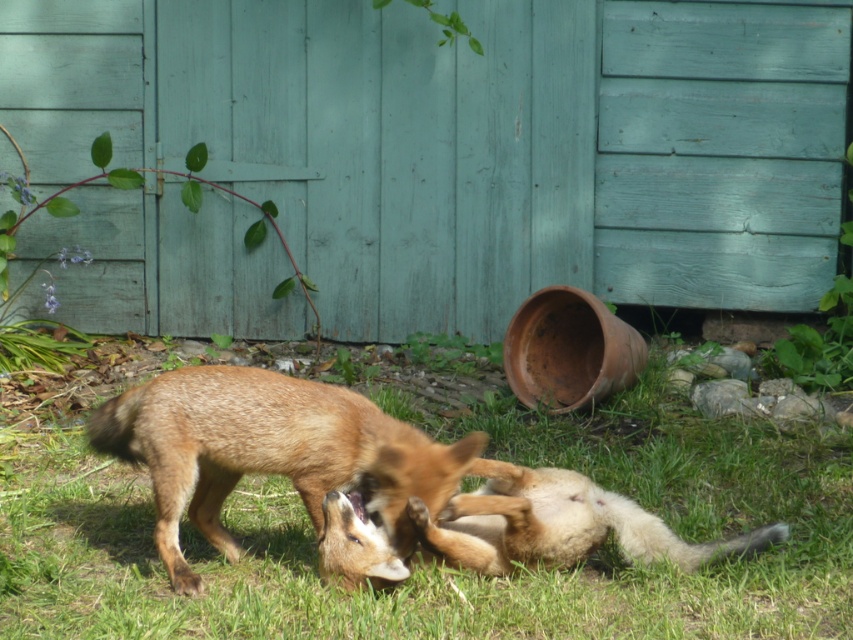
Question: Which object appears closest to the camera in this image?

Choices:
 (A) golden fur fox at center
 (B) green grass at lower center

Answer: (B)

Question: Does green grass at lower center appear on the right side of golden fur fox at center?

Choices:
 (A) yes
 (B) no

Answer: (A)

Question: Considering the relative positions of green grass at lower center and golden fur fox at center in the image provided, where is green grass at lower center located with respect to golden fur fox at center?

Choices:
 (A) right
 (B) left

Answer: (A)

Question: Which of the following is the farthest from the observer?

Choices:
 (A) green grass at lower center
 (B) golden fur fox at center

Answer: (B)

Question: Does green grass at lower center have a smaller size compared to golden fur fox at center?

Choices:
 (A) no
 (B) yes

Answer: (A)